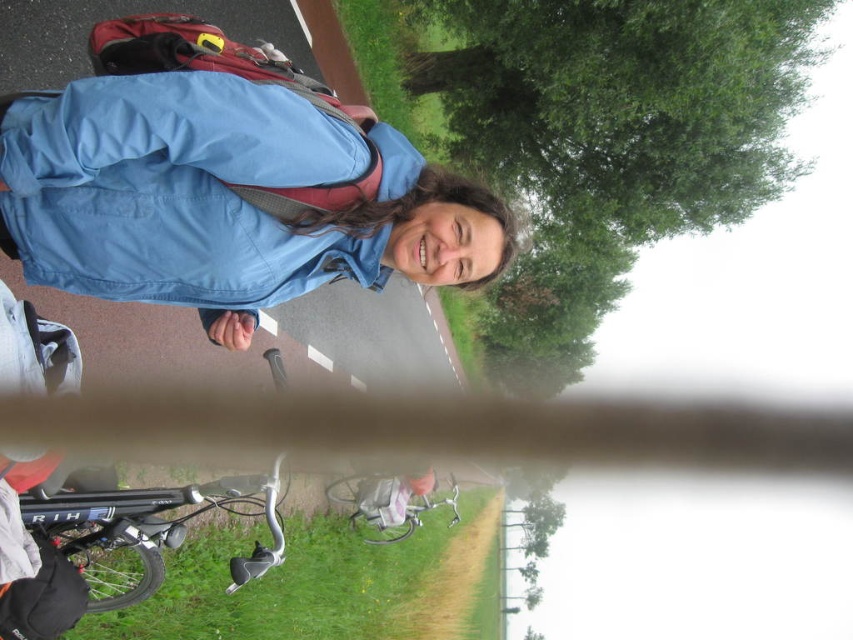
Question: Considering the real-world distances, which object is closest to the metallic silver bicycle at lower center?

Choices:
 (A) shiny black bicycle handlebars at lower left
 (B) blue fabric jacket at center

Answer: (A)

Question: Does shiny black bicycle handlebars at lower left have a smaller size compared to metallic silver bicycle at lower center?

Choices:
 (A) yes
 (B) no

Answer: (A)

Question: Which point appears farthest from the camera in this image?

Choices:
 (A) click(186, 499)
 (B) click(25, 253)

Answer: (A)

Question: Is blue fabric jacket at center further to the viewer compared to shiny black bicycle handlebars at lower left?

Choices:
 (A) no
 (B) yes

Answer: (A)

Question: From the image, what is the correct spatial relationship of blue fabric jacket at center in relation to shiny black bicycle handlebars at lower left?

Choices:
 (A) right
 (B) left

Answer: (A)

Question: Which is nearer to the metallic silver bicycle at lower center?

Choices:
 (A) shiny black bicycle handlebars at lower left
 (B) blue fabric jacket at center

Answer: (A)